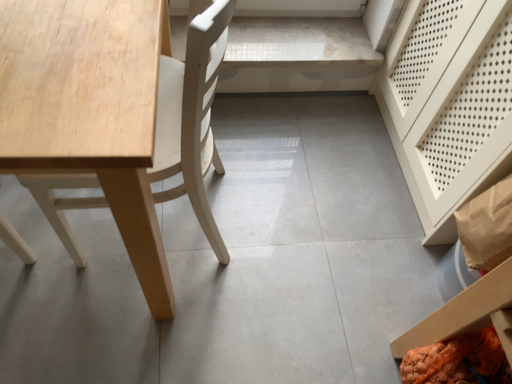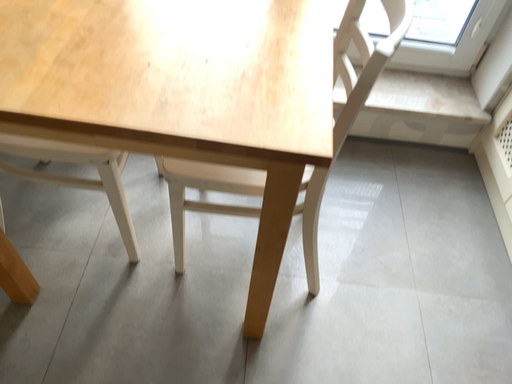
Question: How did the camera likely rotate when shooting the video?

Choices:
 (A) rotated upward
 (B) rotated downward

Answer: (A)